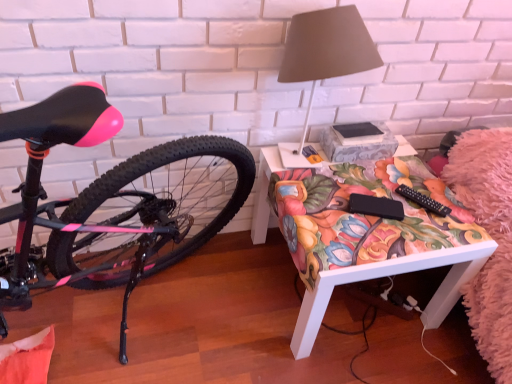
At what (x,y) coordinates should I click in order to perform the action: click on free spot to the right of black plastic remote control at lower right. Please return your answer as a coordinate pair (x, y). Image resolution: width=512 pixels, height=384 pixels. Looking at the image, I should click on (456, 211).